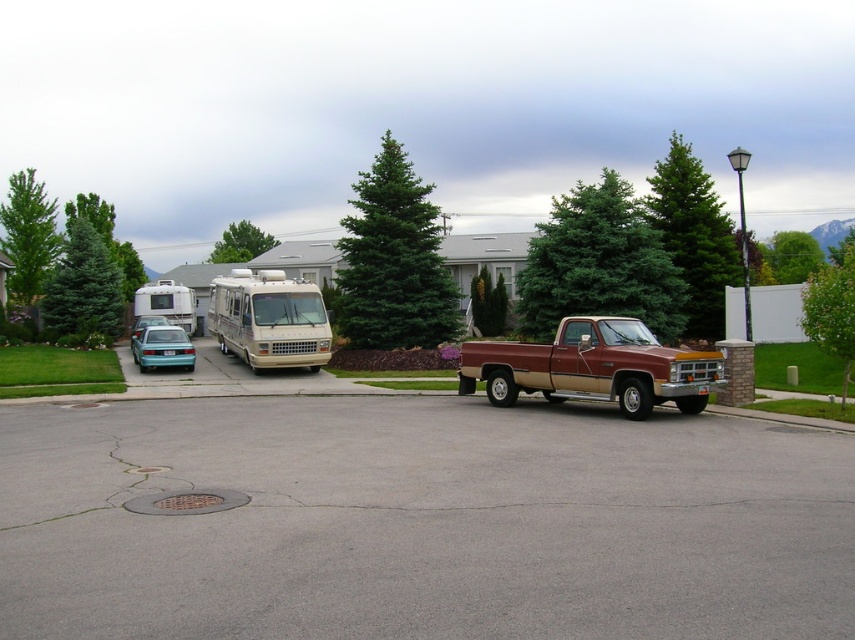
Is gray asphalt parking lot at center in front of green matte tree at center?

Yes, it is.

The width and height of the screenshot is (855, 640). I want to click on gray asphalt parking lot at center, so click(x=422, y=522).

The image size is (855, 640). Identify the location of gray asphalt parking lot at center. (422, 522).

From the picture: Is green textured tree at upper center to the left of green textured tree at upper right from the viewer's perspective?

Indeed, green textured tree at upper center is positioned on the left side of green textured tree at upper right.

Between point (665, 321) and point (677, 136), which one is positioned behind?

Point (677, 136)

Locate an element on the screen. This screenshot has width=855, height=640. green textured tree at upper center is located at coordinates (599, 262).

Which is above, gray asphalt parking lot at center or beige matte rv at center?

Positioned higher is beige matte rv at center.

How distant is gray asphalt parking lot at center from beige matte rv at center?

15.79 meters

Does point (103, 573) lie behind point (278, 353)?

No, it is in front of (278, 353).

The width and height of the screenshot is (855, 640). Identify the location of gray asphalt parking lot at center. (422, 522).